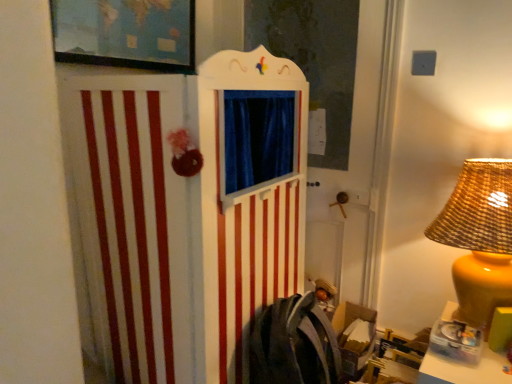
Where is `matte black picture frame at upper left`? matte black picture frame at upper left is located at coordinates (125, 33).

Considering the relative positions of translucent plastic container at lower right and matte yellow lampshade at right in the image provided, is translucent plastic container at lower right in front of matte yellow lampshade at right?

Yes, translucent plastic container at lower right is in front of matte yellow lampshade at right.

From a real-world perspective, relative to matte yellow lampshade at right, is translucent plastic container at lower right vertically above or below?

Clearly, from a real-world perspective, translucent plastic container at lower right is below matte yellow lampshade at right.

Looking at this image, who is taller, translucent plastic container at lower right or matte yellow lampshade at right?

Standing taller between the two is matte yellow lampshade at right.

Which is nearer, (478, 373) or (511, 236)?

Point (478, 373) appears to be farther away from the viewer than point (511, 236).

How different are the orientations of matte yellow lampshade at right and matte black picture frame at upper left in degrees?

The angular difference between matte yellow lampshade at right and matte black picture frame at upper left is 91.7 degrees.

Which object is further away from the camera taking this photo, matte yellow lampshade at right or matte black picture frame at upper left?

matte black picture frame at upper left is behind.

From the image's perspective, is matte yellow lampshade at right positioned above or below matte black picture frame at upper left?

matte yellow lampshade at right is situated lower than matte black picture frame at upper left in the image.

Are matte yellow lampshade at right and matte black picture frame at upper left making contact?

No, matte yellow lampshade at right is not beside matte black picture frame at upper left.

Are matte black picture frame at upper left and translucent plastic container at lower right beside each other?

No, matte black picture frame at upper left is not touching translucent plastic container at lower right.

The image size is (512, 384). I want to click on picture frame lying behind the translucent plastic container at lower right, so click(125, 33).

Is matte black picture frame at upper left spatially inside translucent plastic container at lower right, or outside of it?

matte black picture frame at upper left is not inside translucent plastic container at lower right, it's outside.

Is matte black picture frame at upper left wider or thinner than translucent plastic container at lower right?

Considering their sizes, matte black picture frame at upper left looks slimmer than translucent plastic container at lower right.

Does point (144, 2) come in front of point (486, 306)?

No, it is behind (486, 306).

Based on the photo, are matte black picture frame at upper left and matte yellow lampshade at right located far from each other?

Yes, matte black picture frame at upper left and matte yellow lampshade at right are located far from each other.

This screenshot has width=512, height=384. What are the coordinates of `table lamp that is on the right side of matte black picture frame at upper left` in the screenshot? It's located at (479, 238).

Is matte black picture frame at upper left facing away from matte yellow lampshade at right?

No, matte black picture frame at upper left's orientation is not away from matte yellow lampshade at right.

Considering the sizes of objects translucent plastic container at lower right and matte black picture frame at upper left in the image provided, who is shorter, translucent plastic container at lower right or matte black picture frame at upper left?

Standing shorter between the two is matte black picture frame at upper left.

What's the angular difference between translucent plastic container at lower right and matte black picture frame at upper left's facing directions?

The angular difference between translucent plastic container at lower right and matte black picture frame at upper left is 91.7 degrees.

Which object is positioned more to the left, translucent plastic container at lower right or matte black picture frame at upper left?

From the viewer's perspective, matte black picture frame at upper left appears more on the left side.

Considering the sizes of objects matte yellow lampshade at right and translucent plastic container at lower right in the image provided, who is smaller, matte yellow lampshade at right or translucent plastic container at lower right?

Smaller between the two is translucent plastic container at lower right.

From the image's perspective, is matte yellow lampshade at right located above or below translucent plastic container at lower right?

From the image's perspective, matte yellow lampshade at right appears above translucent plastic container at lower right.

Between matte yellow lampshade at right and translucent plastic container at lower right, which one appears on the left side from the viewer's perspective?

From the viewer's perspective, matte yellow lampshade at right appears more on the left side.

Does matte yellow lampshade at right have a greater height compared to translucent plastic container at lower right?

Yes, matte yellow lampshade at right is taller than translucent plastic container at lower right.

You are a GUI agent. You are given a task and a screenshot of the screen. Output one action in this format:
    pyautogui.click(x=<x>, y=<y>)
    Task: Click on the table lamp behind the translucent plastic container at lower right
    This screenshot has width=512, height=384.
    Given the screenshot: What is the action you would take?
    pyautogui.click(x=479, y=238)

This screenshot has height=384, width=512. Find the location of `table lamp that is under the matte black picture frame at upper left (from a real-world perspective)`. table lamp that is under the matte black picture frame at upper left (from a real-world perspective) is located at coordinates (479, 238).

Which object lies nearer to the anchor point matte yellow lampshade at right, matte black picture frame at upper left or translucent plastic container at lower right?

translucent plastic container at lower right lies closer to matte yellow lampshade at right than the other object.

Based on their spatial positions, is matte yellow lampshade at right or matte black picture frame at upper left further from translucent plastic container at lower right?

Among the two, matte black picture frame at upper left is located further to translucent plastic container at lower right.

Considering their positions, is translucent plastic container at lower right positioned further to matte yellow lampshade at right than matte black picture frame at upper left?

Among the two, matte black picture frame at upper left is located further to matte yellow lampshade at right.

Considering their positions, is matte black picture frame at upper left positioned further to translucent plastic container at lower right than matte yellow lampshade at right?

Based on the image, matte black picture frame at upper left appears to be further to translucent plastic container at lower right.

Looking at the image, which one is located further to matte black picture frame at upper left, translucent plastic container at lower right or matte yellow lampshade at right?

Based on the image, translucent plastic container at lower right appears to be further to matte black picture frame at upper left.

From the image, which object appears to be farther from matte black picture frame at upper left, matte yellow lampshade at right or translucent plastic container at lower right?

The object further to matte black picture frame at upper left is translucent plastic container at lower right.

Where is `table lamp between matte black picture frame at upper left and translucent plastic container at lower right from left to right`? The width and height of the screenshot is (512, 384). table lamp between matte black picture frame at upper left and translucent plastic container at lower right from left to right is located at coordinates (479, 238).